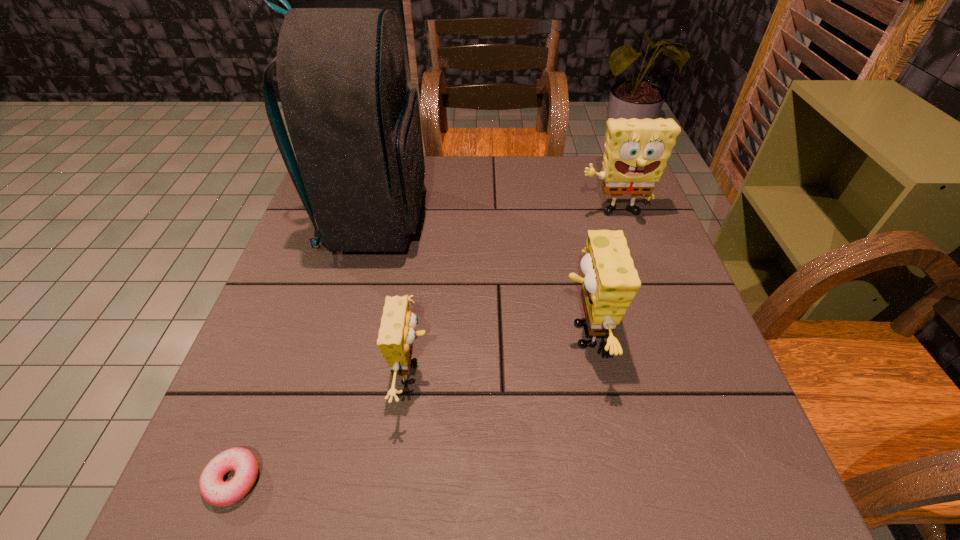
Where is `backpack that is at the far edge`? This screenshot has height=540, width=960. backpack that is at the far edge is located at coordinates (354, 124).

Image resolution: width=960 pixels, height=540 pixels. What are the coordinates of `sponge located at the far edge` in the screenshot? It's located at (636, 150).

Where is `object located at the near edge`? This screenshot has height=540, width=960. object located at the near edge is located at coordinates (214, 490).

In order to click on backpack present at the left edge in this screenshot , I will do `click(354, 124)`.

What are the coordinates of `doughnut present at the left edge` in the screenshot? It's located at (214, 490).

At what (x,y) coordinates should I click in order to perform the action: click on object that is at the right edge. Please return your answer as a coordinate pair (x, y). The height and width of the screenshot is (540, 960). Looking at the image, I should click on (636, 150).

What are the coordinates of `object present at the far left corner` in the screenshot? It's located at (354, 124).

The image size is (960, 540). In order to click on object present at the near left corner in this screenshot , I will do `click(214, 490)`.

Locate an element on the screen. object present at the far right corner is located at coordinates (636, 150).

At what (x,y) coordinates should I click in order to perform the action: click on vacant space at the far edge. Please return your answer as a coordinate pair (x, y). The height and width of the screenshot is (540, 960). Looking at the image, I should click on (536, 182).